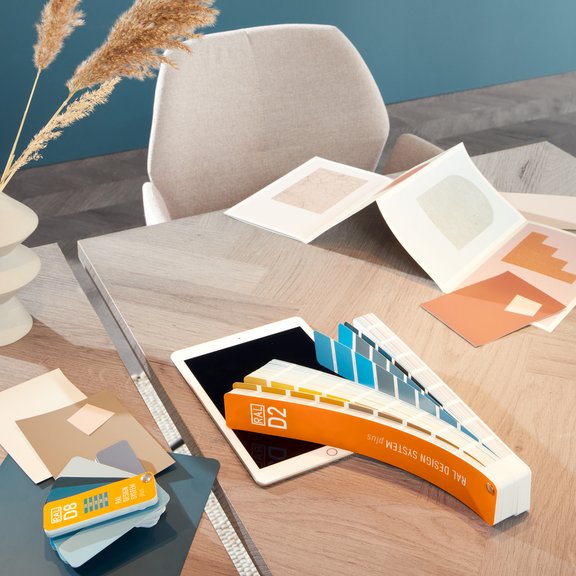
This screenshot has height=576, width=576. Identify the location of white vase. (25, 270).